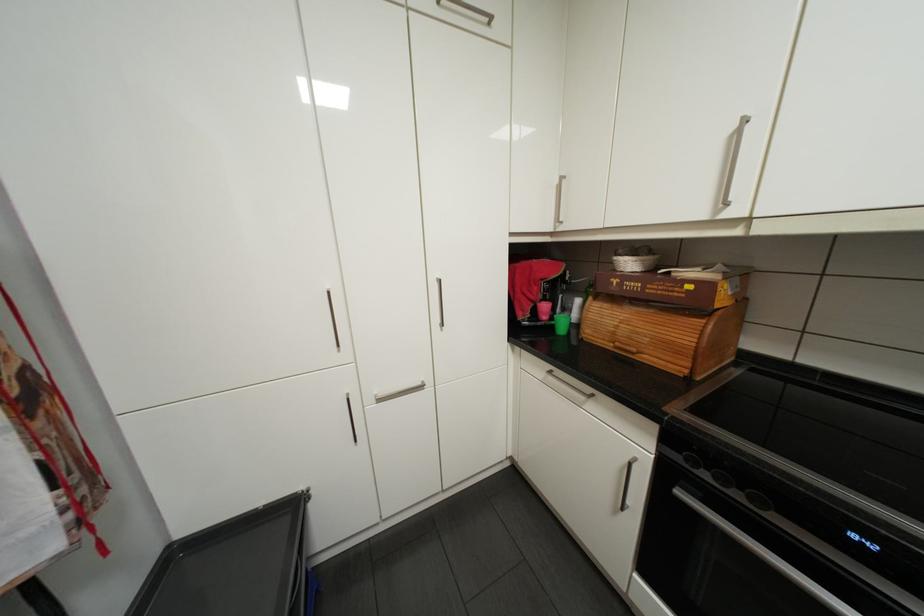
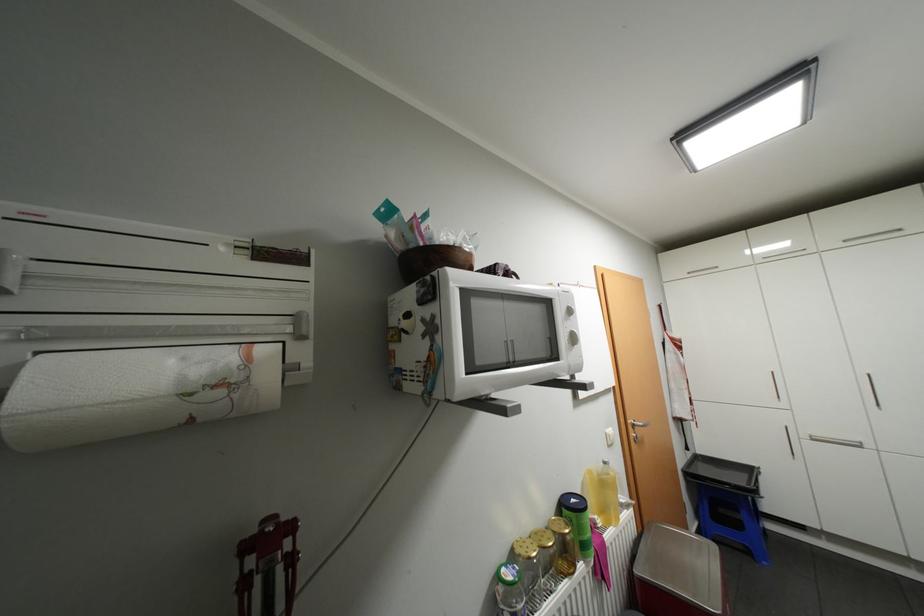
Locate, in the second image, the point that corresponds to point (387, 399) in the first image.

(821, 438)